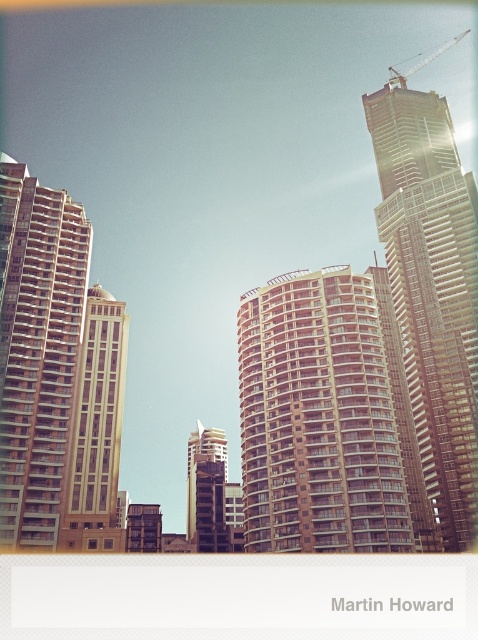
Between glassy steel skyscraper at upper right and brown glass building at left, which one has less height?

Standing shorter between the two is brown glass building at left.

Who is lower down, glassy steel skyscraper at upper right or brown glass building at left?

brown glass building at left is lower down.

What do you see at coordinates (432, 291) in the screenshot?
I see `glassy steel skyscraper at upper right` at bounding box center [432, 291].

This screenshot has width=478, height=640. I want to click on glassy steel skyscraper at upper right, so pyautogui.click(x=432, y=291).

Is brown glass building at left below metallic gray crane at upper right?

Indeed, brown glass building at left is positioned under metallic gray crane at upper right.

What do you see at coordinates (36, 348) in the screenshot? This screenshot has width=478, height=640. I see `brown glass building at left` at bounding box center [36, 348].

This screenshot has width=478, height=640. Find the location of `brown glass building at left`. brown glass building at left is located at coordinates (36, 348).

Between brown glass building at left and metallic glass tower at center, which one is positioned higher?

brown glass building at left is higher up.

Measure the distance between brown glass building at left and camera.

brown glass building at left and camera are 58.85 meters apart.

Where is `brown glass building at left`? brown glass building at left is located at coordinates (36, 348).